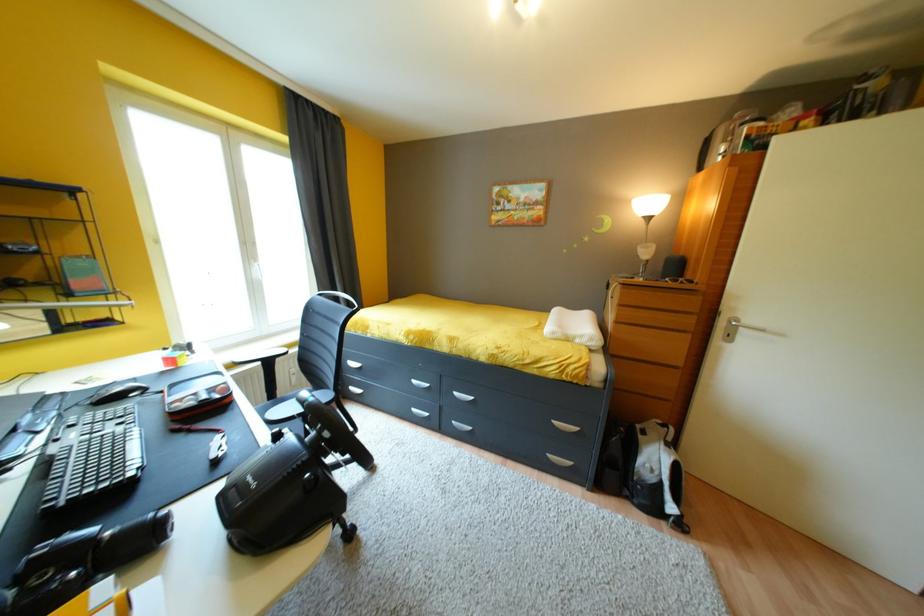
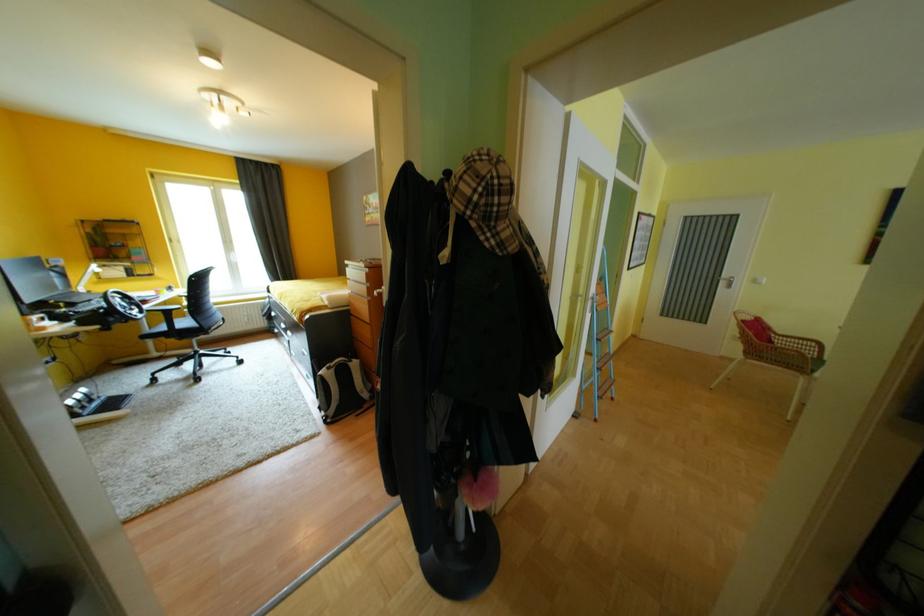
Question: What movement of the cameraman would produce the second image?

Choices:
 (A) Left
 (B) Right
 (C) Forward
 (D) Backward

Answer: (B)